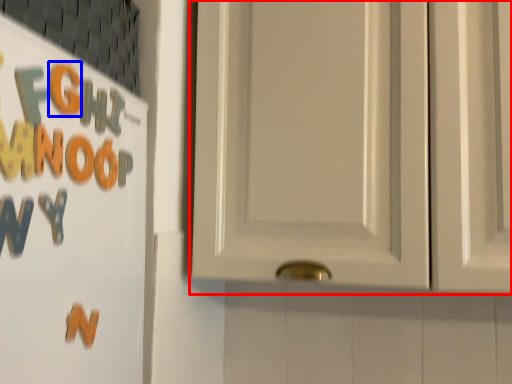
Question: Which object appears farthest to the camera in this image, door (highlighted by a red box) or letter (highlighted by a blue box)?

Choices:
 (A) door
 (B) letter

Answer: (A)